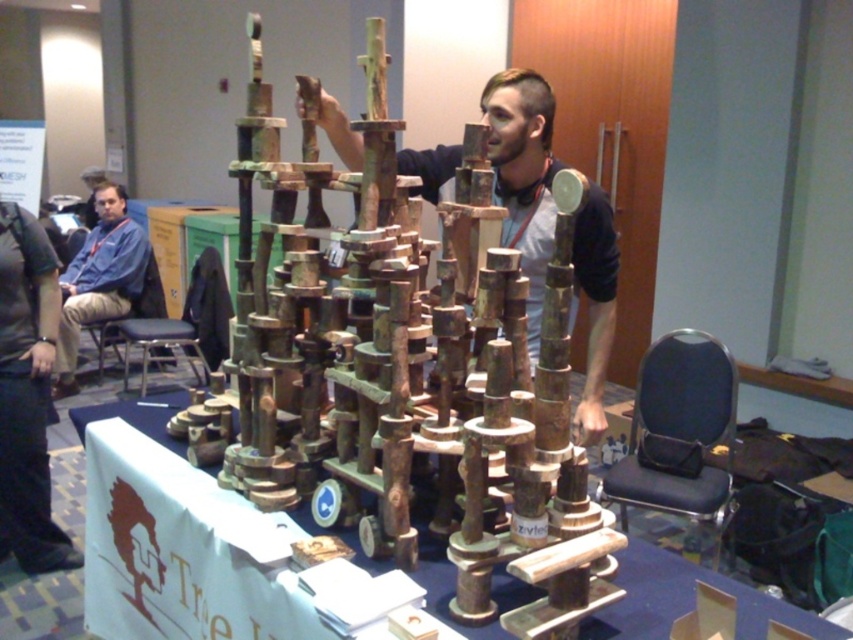
You are a visitor in the room and want to sit down. You see the rusty metal structure at center and the blue fabric stool at lower left. Which object is shorter and therefore a better option for sitting?

The rusty metal structure at center is shorter than the blue fabric stool at lower left, so it might not be suitable for sitting. The blue fabric stool at lower left is taller and likely a better option for sitting.

Consider the image. You are standing in the room and want to sit down on the blue fabric stool at lower left. Where should you look to find it relative to the rusty metal structure at center?

The blue fabric stool at lower left is located above the rusty metal structure at center, so you should look upwards from the rusty metal structure at center to find it.

You are standing in front of the indoor setting where a man is interacting with two wooden sculptures. The scene includes a rusty wood sculpture at center and a wooden sculpture at center. Which sculpture is positioned to the left?

The rusty wood sculpture at center is positioned to the left of the wooden sculpture at center.